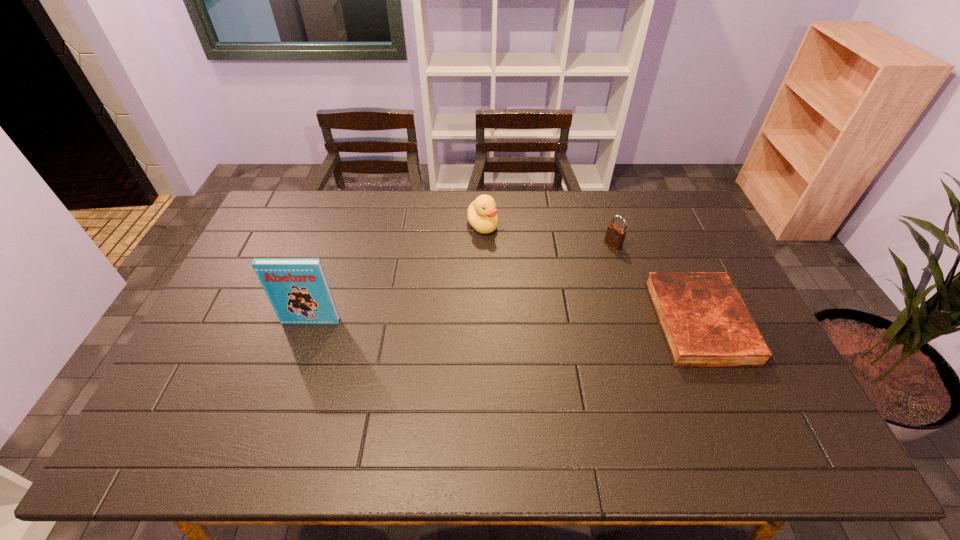
At what (x,y) coordinates should I click in order to perform the action: click on free point between the tallest object and the second object from right to left. Please return your answer as a coordinate pair (x, y). Looking at the image, I should click on (462, 283).

Where is `vacant region between the book and the third nearest object`? The width and height of the screenshot is (960, 540). vacant region between the book and the third nearest object is located at coordinates (462, 283).

Select which object appears as the second closest to the second object from left to right. Please provide its 2D coordinates. Your answer should be formatted as a tuple, i.e. [(x, y)], where the tuple contains the x and y coordinates of a point satisfying the conditions above.

[(705, 322)]

Select which object appears as the second closest to the padlock. Please provide its 2D coordinates. Your answer should be formatted as a tuple, i.e. [(x, y)], where the tuple contains the x and y coordinates of a point satisfying the conditions above.

[(482, 214)]

The height and width of the screenshot is (540, 960). Identify the location of vacant position in the image that satisfies the following two spatial constraints: 1. on the front side of the rightmost object; 2. on the spine side of the third nearest object. (637, 322).

I want to click on vacant area in the image that satisfies the following two spatial constraints: 1. on the front side of the second object from left to right; 2. on the right side of the third nearest object, so click(483, 244).

This screenshot has width=960, height=540. I want to click on vacant space that satisfies the following two spatial constraints: 1. on the front cover of the book; 2. on the spine side of the rightmost object, so click(311, 322).

Locate an element on the screen. Image resolution: width=960 pixels, height=540 pixels. vacant space that satisfies the following two spatial constraints: 1. on the front cover of the book; 2. on the spine side of the Bible is located at coordinates (311, 322).

This screenshot has height=540, width=960. I want to click on vacant space that satisfies the following two spatial constraints: 1. on the front side of the third object from right to left; 2. on the right side of the third nearest object, so click(483, 244).

This screenshot has width=960, height=540. In order to click on free region that satisfies the following two spatial constraints: 1. on the front cover of the tallest object; 2. on the spine side of the rightmost object in this screenshot , I will do click(311, 322).